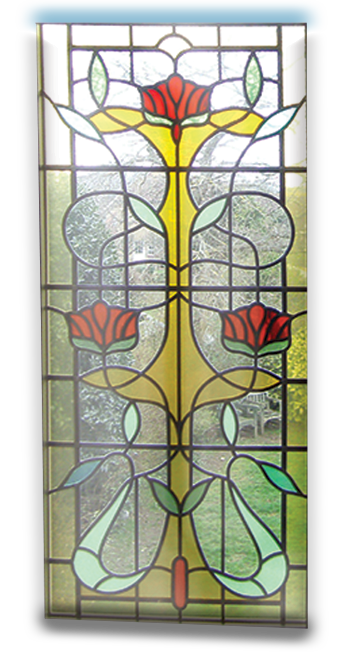
The height and width of the screenshot is (662, 347). What are the coordinates of `bottom front right corner of art` in the screenshot? It's located at (305, 621).